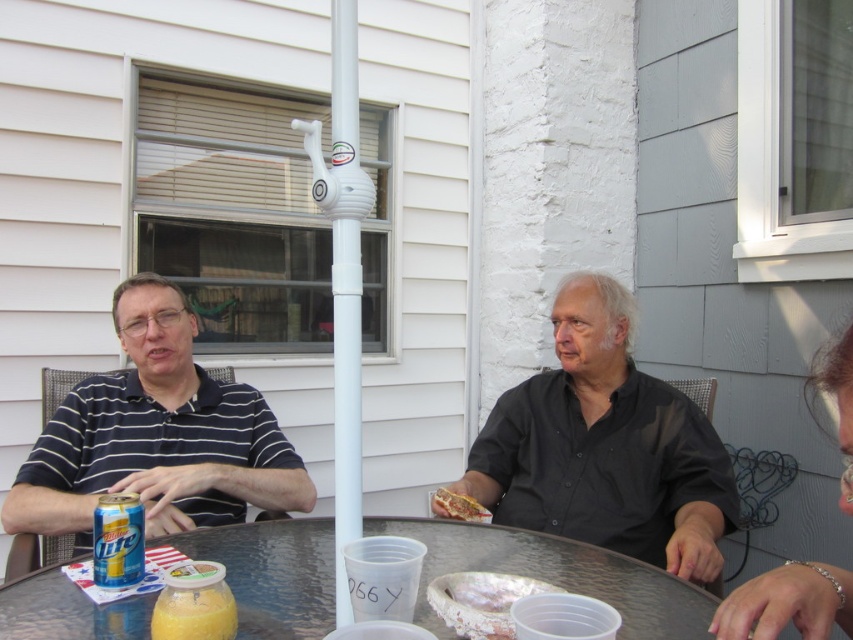
You are a photographer trying to capture a candid shot of the people at the gathering. Since the black matte shirt at center and the translucent plastic table at center are both in the frame, which object will appear larger in your photo?

The black matte shirt at center will appear larger in the photo because it is much taller than the translucent plastic table at center.